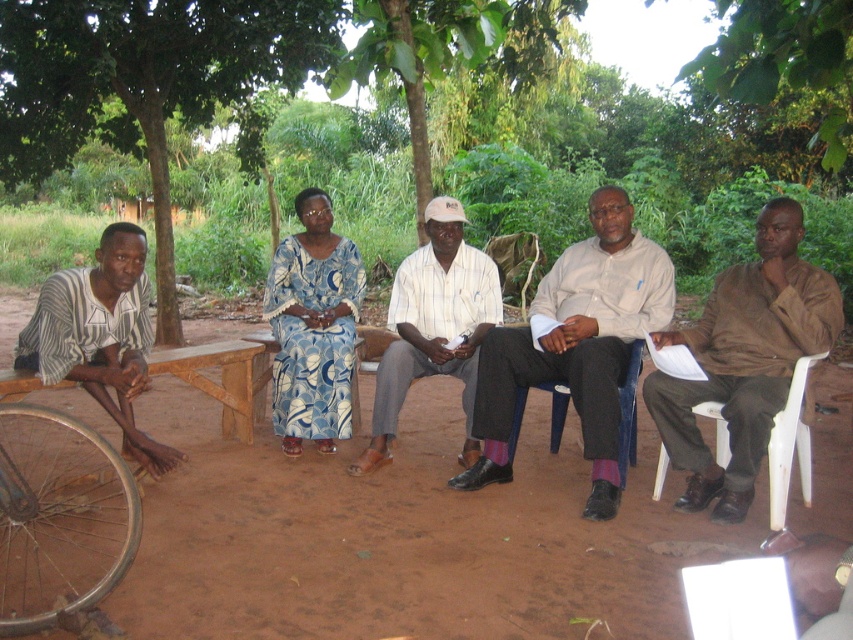
Consider the image. You are a photographer trying to capture a clear shot of the white striped shirt at center and the white plastic chair at right. Since both are white, you want to ensure they are distinguishable in the photo. Based on their positions, which object is higher up in the image?

The white striped shirt at center is above the white plastic chair at right, so in the photo, the white striped shirt at center will appear higher and thus more distinguishable due to its elevated position.

You are standing at the center of the image and want to locate the point marked at coordinates point (143, 81). Based on the scene description, where would this point be located relative to the green leafy tree at upper left?

The point (143, 81) is located on the green leafy tree at upper left.